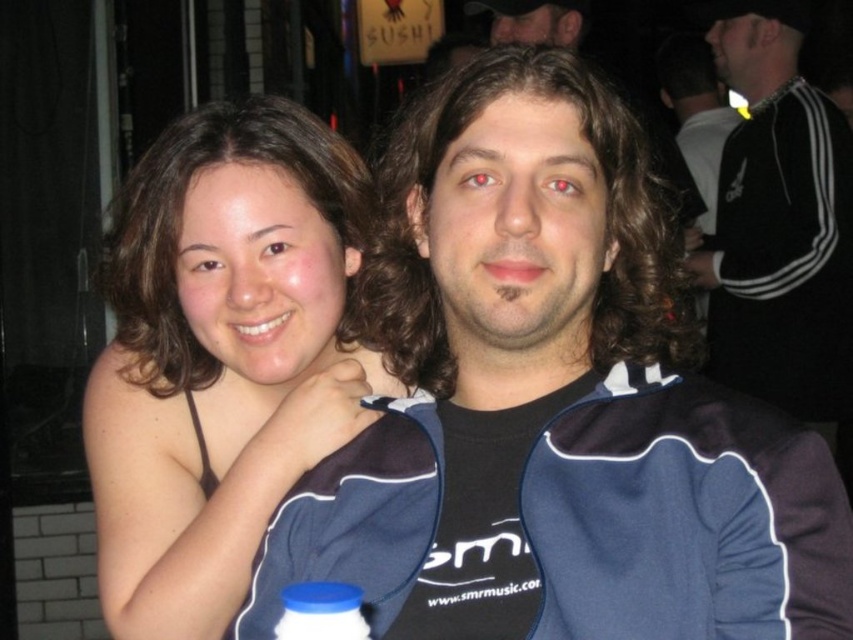
Can you confirm if brown hair at upper left is positioned above matte black hair at upper center?

No, brown hair at upper left is not above matte black hair at upper center.

Does brown hair at upper left lie in front of matte black hair at upper center?

Yes, brown hair at upper left is closer to the viewer.

Is point (193, 524) closer to camera compared to point (560, 29)?

Yes.

This screenshot has width=853, height=640. What are the coordinates of `brown hair at upper left` in the screenshot? It's located at (221, 356).

How distant is brown hair at upper left from black adidas tracksuit at right?

brown hair at upper left is 7.90 feet from black adidas tracksuit at right.

Can you confirm if brown hair at upper left is wider than black adidas tracksuit at right?

In fact, brown hair at upper left might be narrower than black adidas tracksuit at right.

The width and height of the screenshot is (853, 640). Find the location of `brown hair at upper left`. brown hair at upper left is located at coordinates (221, 356).

The height and width of the screenshot is (640, 853). In order to click on brown hair at upper left in this screenshot , I will do `click(221, 356)`.

Does black adidas tracksuit at right have a larger size compared to blue plastic bottle at lower center?

Correct, black adidas tracksuit at right is larger in size than blue plastic bottle at lower center.

Which of these two, black adidas tracksuit at right or blue plastic bottle at lower center, stands shorter?

blue plastic bottle at lower center is shorter.

Who is more forward, [793,120] or [300,620]?

Point [300,620] is in front.

This screenshot has height=640, width=853. In order to click on black adidas tracksuit at right in this screenshot , I will do `click(780, 225)`.